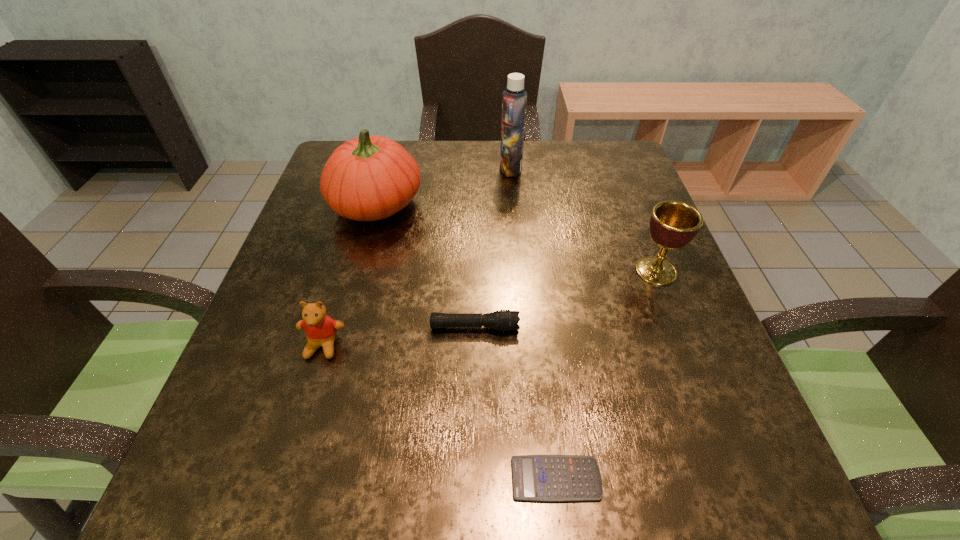
In order to click on vacant region between the flashlight and the nearest object in this screenshot , I will do `click(516, 403)`.

This screenshot has width=960, height=540. Find the location of `empty space between the tallest object and the teddy bear`. empty space between the tallest object and the teddy bear is located at coordinates (417, 257).

The width and height of the screenshot is (960, 540). Find the location of `free space between the fourth nearest object and the pumpkin`. free space between the fourth nearest object and the pumpkin is located at coordinates (516, 238).

Image resolution: width=960 pixels, height=540 pixels. What are the coordinates of `free spot between the rightmost object and the teddy bear` in the screenshot? It's located at (490, 308).

Where is `vacant area that lies between the teddy bear and the shampoo`? The height and width of the screenshot is (540, 960). vacant area that lies between the teddy bear and the shampoo is located at coordinates (417, 257).

Where is `blank region between the rightmost object and the nearest object`? blank region between the rightmost object and the nearest object is located at coordinates (606, 375).

Where is `free point between the third tallest object and the second shortest object`? The image size is (960, 540). free point between the third tallest object and the second shortest object is located at coordinates (565, 299).

This screenshot has height=540, width=960. In order to click on vacant space that is in between the pumpkin and the shampoo in this screenshot , I will do `click(444, 187)`.

At what (x,y) coordinates should I click in order to perform the action: click on the fifth closest object to the flashlight. Please return your answer as a coordinate pair (x, y). Image resolution: width=960 pixels, height=540 pixels. Looking at the image, I should click on (514, 100).

Find the location of a particular element. The image size is (960, 540). the second closest object to the shortest object is located at coordinates (320, 329).